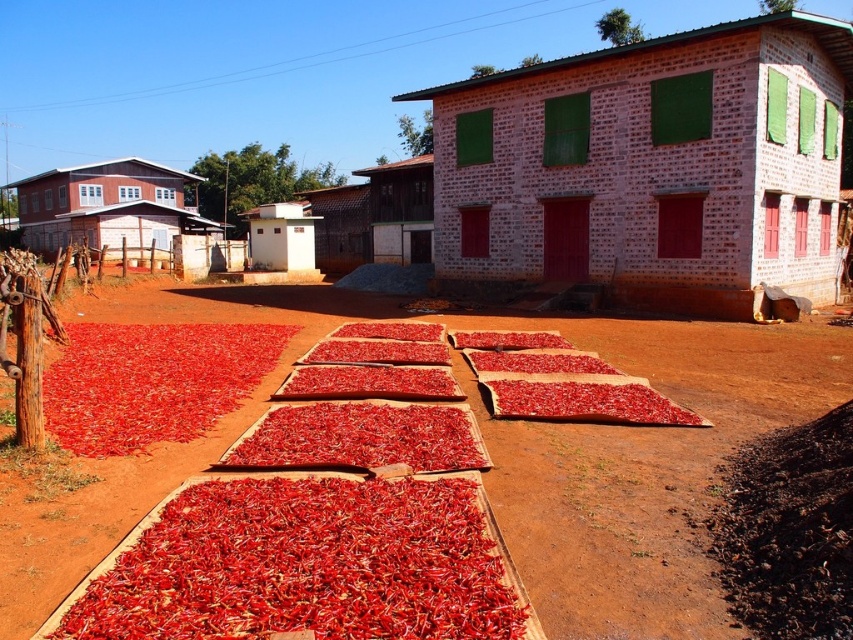
Question: From the image, what is the correct spatial relationship of red dirt field at center in relation to brown wooden hut at center?

Choices:
 (A) left
 (B) right

Answer: (B)

Question: Does brick wall house at center appear on the left side of wooden hut at center?

Choices:
 (A) no
 (B) yes

Answer: (A)

Question: Considering the real-world distances, which object is farthest from the red dirt field at center?

Choices:
 (A) brown wooden hut at center
 (B) matte wood hut at left
 (C) brick wall house at center

Answer: (B)

Question: Which point is closer to the camera?

Choices:
 (A) (370, 204)
 (B) (341, 244)

Answer: (A)

Question: Based on their relative distances, which object is farther from the wooden hut at center?

Choices:
 (A) white brick hut at center
 (B) red dirt field at center
 (C) matte wood hut at left
 (D) brown wooden hut at center

Answer: (C)

Question: From the image, what is the correct spatial relationship of matte wood hut at left in relation to brown wooden hut at center?

Choices:
 (A) right
 (B) left

Answer: (B)